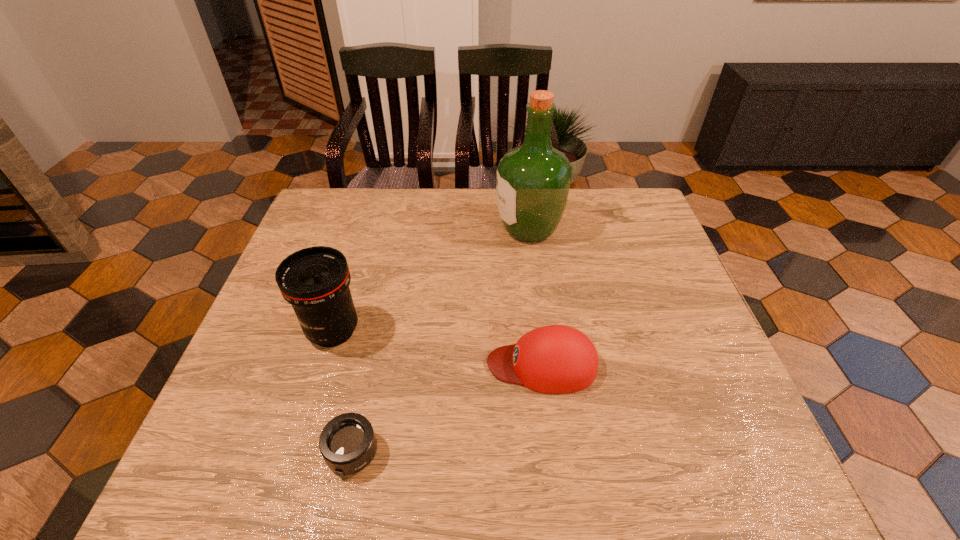
The width and height of the screenshot is (960, 540). I want to click on the farthest object, so click(x=533, y=180).

This screenshot has height=540, width=960. What are the coordinates of `the tallest object` in the screenshot? It's located at (533, 180).

The image size is (960, 540). What are the coordinates of `the farther telephoto lens` in the screenshot? It's located at (315, 281).

You are a GUI agent. You are given a task and a screenshot of the screen. Output one action in this format:
    pyautogui.click(x=<x>, y=<y>)
    Task: Click on the second tallest object
    
    Given the screenshot: What is the action you would take?
    pyautogui.click(x=315, y=281)

The width and height of the screenshot is (960, 540). Find the location of `baseball cap`. baseball cap is located at coordinates (555, 359).

The width and height of the screenshot is (960, 540). I want to click on the shortest object, so click(x=347, y=443).

You are a GUI agent. You are given a task and a screenshot of the screen. Output one action in this format:
    pyautogui.click(x=<x>, y=<y>)
    Task: Click on the nearer telephoto lens
    The width and height of the screenshot is (960, 540).
    Given the screenshot: What is the action you would take?
    pyautogui.click(x=347, y=443)

In order to click on free region located 0.120m on the front-facing side of the liquor in this screenshot , I will do `click(455, 229)`.

Where is `vacant region located 0.120m on the front-facing side of the liquor`? The image size is (960, 540). vacant region located 0.120m on the front-facing side of the liquor is located at coordinates (455, 229).

Where is `free space located on the front-facing side of the liquor`? free space located on the front-facing side of the liquor is located at coordinates (425, 229).